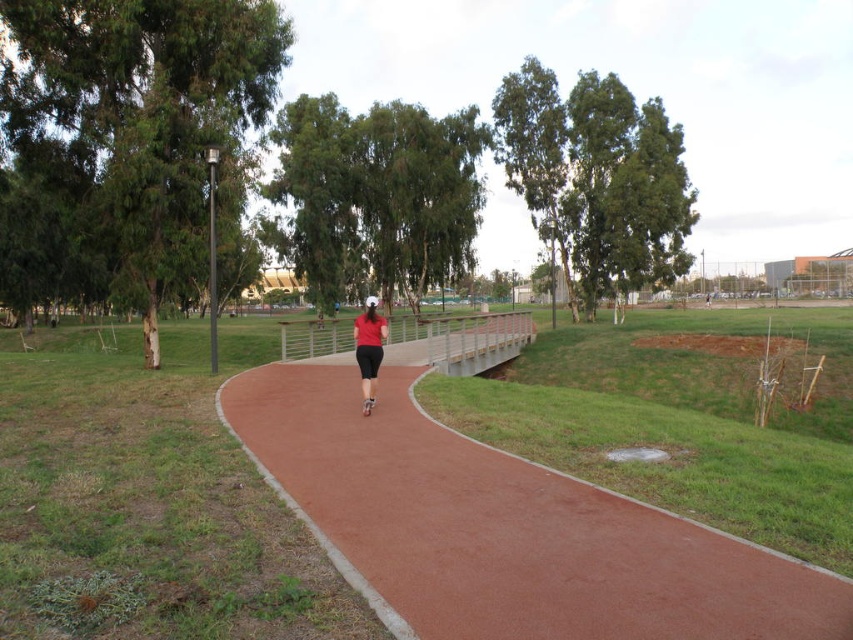
Is smooth reddish-brown trail at center above matte red shirt at center?

No.

Between smooth reddish-brown trail at center and matte red shirt at center, which one appears on the left side from the viewer's perspective?

Positioned to the left is matte red shirt at center.

Is point (650, 579) positioned before point (363, 336)?

Yes.

Identify the location of smooth reddish-brown trail at center. This screenshot has height=640, width=853. (503, 529).